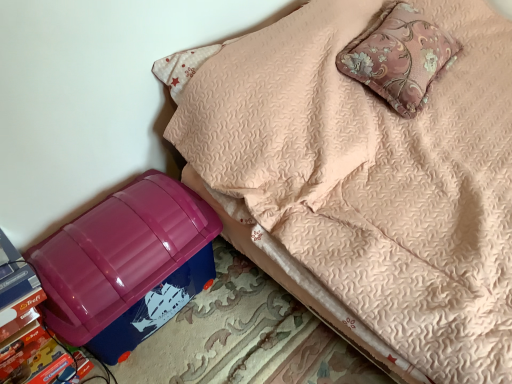
Find the location of `blue plastic storage bin at lower left`. blue plastic storage bin at lower left is located at coordinates (367, 172).

Between blue plastic storage bin at lower left and glossy plastic storage box at lower left, which one has more height?

blue plastic storage bin at lower left.

Where is `furniture that appears above the glossy plastic storage box at lower left (from the image's perspective)`? furniture that appears above the glossy plastic storage box at lower left (from the image's perspective) is located at coordinates 367,172.

Considering the positions of objects blue plastic storage bin at lower left and glossy plastic storage box at lower left in the image provided, who is behind, blue plastic storage bin at lower left or glossy plastic storage box at lower left?

glossy plastic storage box at lower left is more distant.

Considering the relative positions of blue plastic storage bin at lower left and glossy plastic storage box at lower left in the image provided, is blue plastic storage bin at lower left to the left or to the right of glossy plastic storage box at lower left?

blue plastic storage bin at lower left is to the right of glossy plastic storage box at lower left.

Are glossy plastic storage box at lower left and blue plastic storage bin at lower left beside each other?

No, glossy plastic storage box at lower left is not making contact with blue plastic storage bin at lower left.

From the image's perspective, which one is positioned higher, glossy plastic storage box at lower left or blue plastic storage bin at lower left?

blue plastic storage bin at lower left is shown above in the image.

Consider the image. What's the angular difference between glossy plastic storage box at lower left and blue plastic storage bin at lower left's facing directions?

They differ by 89.4 degrees in their facing directions.

Considering the sizes of pink floral cushion at upper right and glossy plastic storage box at lower left in the image, is pink floral cushion at upper right taller or shorter than glossy plastic storage box at lower left?

Considering their sizes, pink floral cushion at upper right has less height than glossy plastic storage box at lower left.

Between pink floral cushion at upper right and glossy plastic storage box at lower left, which one appears on the right side from the viewer's perspective?

pink floral cushion at upper right.

Is pink floral cushion at upper right in front of or behind glossy plastic storage box at lower left in the image?

pink floral cushion at upper right is behind glossy plastic storage box at lower left.

Is the position of glossy plastic storage box at lower left more distant than that of pink floral cushion at upper right?

No, the depth of glossy plastic storage box at lower left is less than that of pink floral cushion at upper right.

Looking at this image, is glossy plastic storage box at lower left bigger than pink floral cushion at upper right?

Yes.

Is glossy plastic storage box at lower left inside the boundaries of pink floral cushion at upper right, or outside?

glossy plastic storage box at lower left exists outside the volume of pink floral cushion at upper right.

Which object is positioned more to the right, glossy plastic storage box at lower left or pink floral cushion at upper right?

pink floral cushion at upper right is more to the right.

Is blue plastic storage bin at lower left in front of or behind pink floral cushion at upper right in the image?

Clearly, blue plastic storage bin at lower left is in front of pink floral cushion at upper right.

From their relative heights in the image, would you say blue plastic storage bin at lower left is taller or shorter than pink floral cushion at upper right?

Considering their sizes, blue plastic storage bin at lower left has more height than pink floral cushion at upper right.

How different are the orientations of blue plastic storage bin at lower left and pink floral cushion at upper right in degrees?

blue plastic storage bin at lower left and pink floral cushion at upper right are facing 7.88 degrees away from each other.

From a real-world perspective, is blue plastic storage bin at lower left above or below pink floral cushion at upper right?

Clearly, from a real-world perspective, blue plastic storage bin at lower left is below pink floral cushion at upper right.

Would you say pink floral cushion at upper right is inside or outside blue plastic storage bin at lower left?

pink floral cushion at upper right is enclosed within blue plastic storage bin at lower left.

From a real-world perspective, who is located lower, pink floral cushion at upper right or blue plastic storage bin at lower left?

In real-world perspective, blue plastic storage bin at lower left is lower.

Looking at their sizes, would you say pink floral cushion at upper right is wider or thinner than blue plastic storage bin at lower left?

In the image, pink floral cushion at upper right appears to be more narrow than blue plastic storage bin at lower left.

Identify the location of storage box that appears behind the blue plastic storage bin at lower left. (126, 265).

In the image, there is a blue plastic storage bin at lower left. What are the coordinates of `storage box below it (from the image's perspective)` in the screenshot? It's located at (126, 265).

Based on the photo, when comparing their distances from blue plastic storage bin at lower left, does glossy plastic storage box at lower left or pink floral cushion at upper right seem closer?

Based on the image, pink floral cushion at upper right appears to be nearer to blue plastic storage bin at lower left.

Looking at the image, which one is located further to glossy plastic storage box at lower left, blue plastic storage bin at lower left or pink floral cushion at upper right?

Based on the image, pink floral cushion at upper right appears to be further to glossy plastic storage box at lower left.

Which object lies further to the anchor point pink floral cushion at upper right, blue plastic storage bin at lower left or glossy plastic storage box at lower left?

Among the two, glossy plastic storage box at lower left is located further to pink floral cushion at upper right.

Looking at the image, which one is located further to blue plastic storage bin at lower left, pink floral cushion at upper right or glossy plastic storage box at lower left?

glossy plastic storage box at lower left.

Looking at the image, which one is located closer to glossy plastic storage box at lower left, pink floral cushion at upper right or blue plastic storage bin at lower left?

Among the two, blue plastic storage bin at lower left is located nearer to glossy plastic storage box at lower left.

Estimate the real-world distances between objects in this image. Which object is closer to pink floral cushion at upper right, glossy plastic storage box at lower left or blue plastic storage bin at lower left?

blue plastic storage bin at lower left lies closer to pink floral cushion at upper right than the other object.

Locate an element on the screen. pillow located between glossy plastic storage box at lower left and blue plastic storage bin at lower left in the left-right direction is located at coordinates (399, 57).